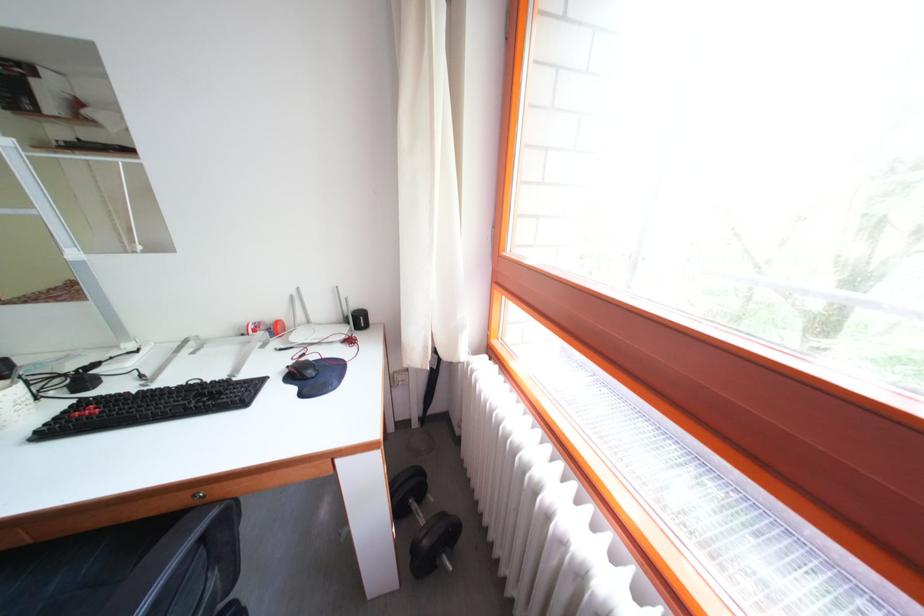
Find where to lift the black keyboard. Please return your answer as a coordinate pair (x, y).

(149, 407)